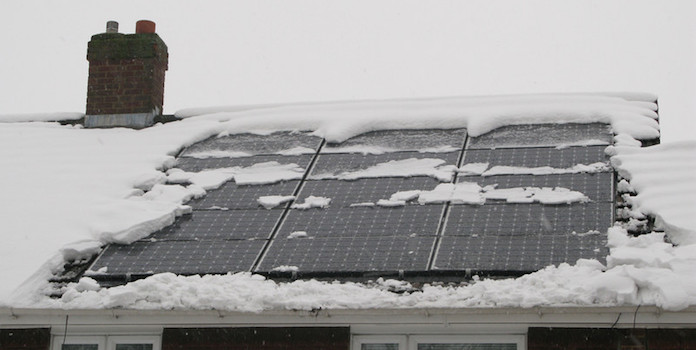
Identify the location of 2 pipes in chimney. (113, 29), (150, 24).